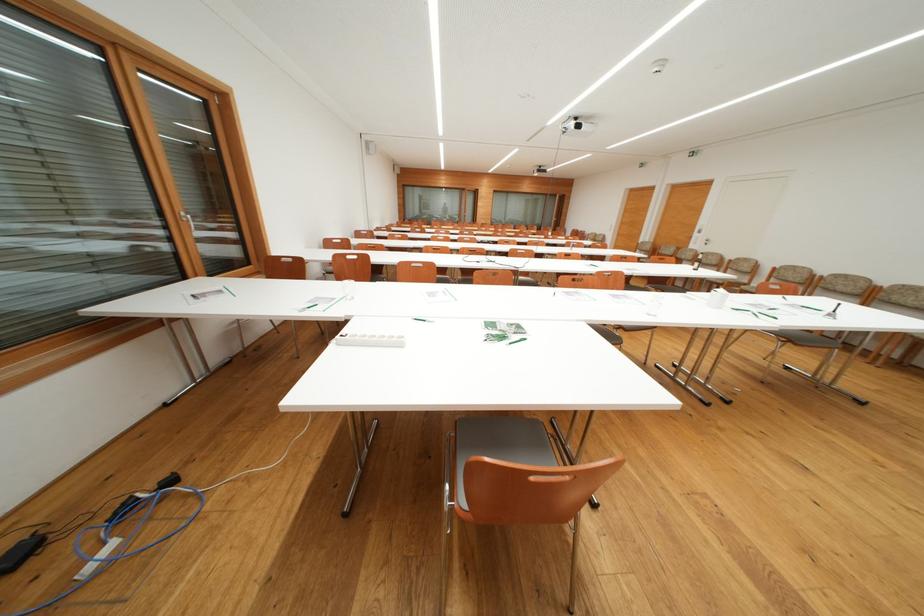
The location [716,298] corresponds to which object?

This point indicates the white plastic bottle.